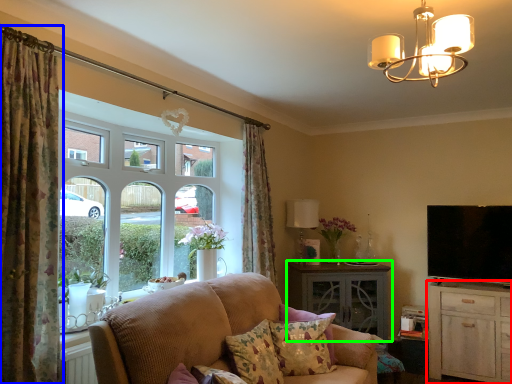
Question: Which object is the closest to the cabinetry (highlighted by a red box)? Choose among these: curtain (highlighted by a blue box) or table (highlighted by a green box).

Choices:
 (A) curtain
 (B) table

Answer: (B)